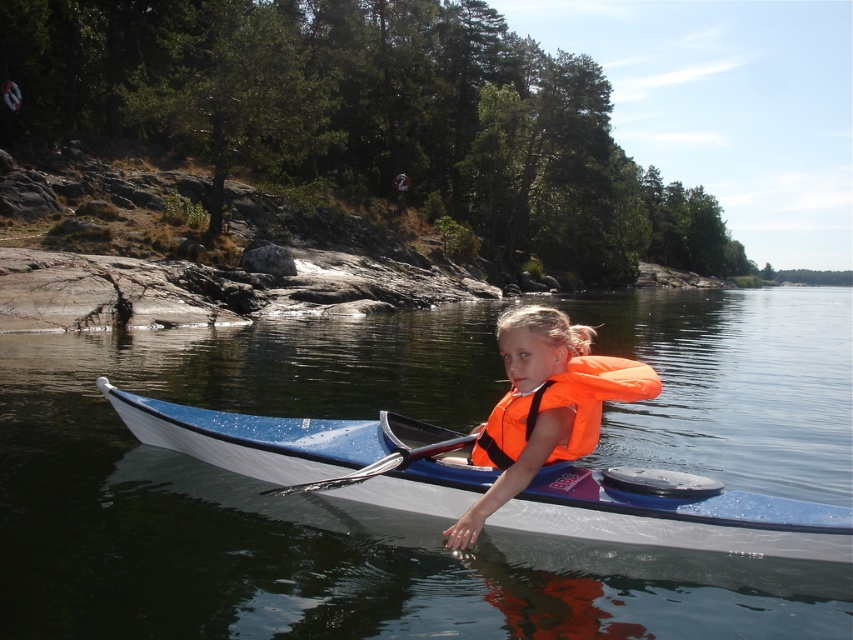
Who is positioned more to the right, transparent blue water at center or orange fabric life jacket at center?

Positioned to the right is transparent blue water at center.

Can you confirm if transparent blue water at center is positioned below orange fabric life jacket at center?

No, transparent blue water at center is not below orange fabric life jacket at center.

What do you see at coordinates (318, 506) in the screenshot? I see `transparent blue water at center` at bounding box center [318, 506].

Find the location of `transparent blue water at center`. transparent blue water at center is located at coordinates (318, 506).

Is blue glossy kayak at center bigger than metallic silver paddle at center?

Indeed, blue glossy kayak at center has a larger size compared to metallic silver paddle at center.

Is blue glossy kayak at center further to the viewer compared to metallic silver paddle at center?

No, it is in front of metallic silver paddle at center.

Is point (682, 529) behind point (306, 490)?

No, it is not.

Where is `blue glossy kayak at center`? The image size is (853, 640). blue glossy kayak at center is located at coordinates (676, 516).

Is point (370, 452) positioned in front of point (584, 410)?

No.

Which of these two, blue glossy kayak at center or orange fabric life jacket at center, stands shorter?

Standing shorter between the two is orange fabric life jacket at center.

Is point (566, 529) positioned behind point (538, 412)?

That is True.

I want to click on blue glossy kayak at center, so click(676, 516).